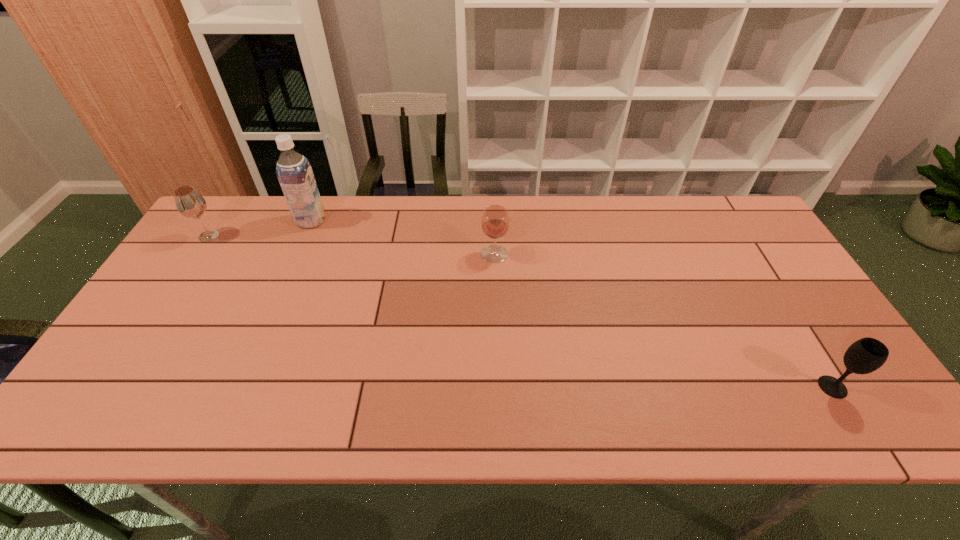
The height and width of the screenshot is (540, 960). I want to click on soya milk, so click(294, 172).

I want to click on the tallest object, so click(294, 172).

Locate an element on the screen. The height and width of the screenshot is (540, 960). the leftmost wineglass is located at coordinates (189, 202).

You are a GUI agent. You are given a task and a screenshot of the screen. Output one action in this format:
    pyautogui.click(x=<x>, y=<y>)
    Task: Click on the leftmost object
    The width and height of the screenshot is (960, 540).
    Given the screenshot: What is the action you would take?
    (189, 202)

Where is `the second wineglass from left to right`? the second wineglass from left to right is located at coordinates (495, 221).

Identify the location of the second farthest wineglass. Image resolution: width=960 pixels, height=540 pixels. (495, 221).

At what (x,y) coordinates should I click in order to perform the action: click on the rightmost object. Please return your answer as a coordinate pair (x, y). Looking at the image, I should click on 866,355.

Where is `the nearest wineglass`? The height and width of the screenshot is (540, 960). the nearest wineglass is located at coordinates (866, 355).

At what (x,y) coordinates should I click in order to perform the action: click on free spot located 0.370m on the label of the second object from left to right. Please return your answer as a coordinate pair (x, y). This screenshot has height=540, width=960. Looking at the image, I should click on (439, 221).

Find the location of a particular element. This screenshot has width=960, height=540. free point located on the front of the farthest wineglass is located at coordinates coord(151,325).